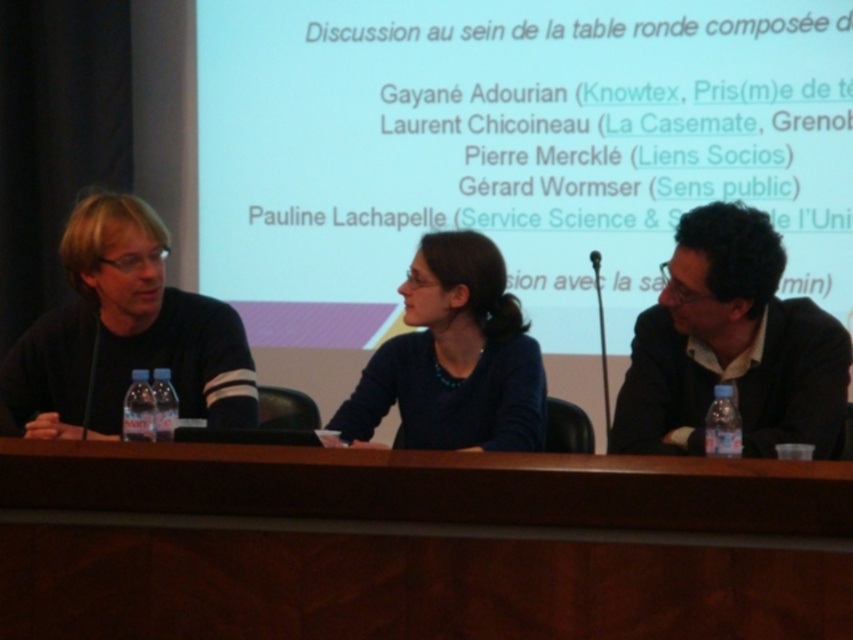
You are a photographer setting up for a panel discussion. You need to decide where to place a spotlight so that it can illuminate both the dark brown leather jacket at right and the matte blue sweater at center without causing glare on the projection screen. Considering their heights, which object should the spotlight be angled towards first?

The dark brown leather jacket at right is taller than the matte blue sweater at center, so the spotlight should be angled towards the dark brown leather jacket at right first to ensure both are illuminated without glare.

You are a photographer adjusting your camera settings to capture the panel discussion. You notice two points of interest in your viewfinder at coordinates point (x=45, y=566) and point (x=740, y=284). Which point is closer to your camera lens?

Point (x=45, y=566) is closer to the viewer than point (x=740, y=284).

You are organizing a small event and need to seat 4 people around the brown wood table at center. The matte blue sweater at center is currently placed on the table. Considering the table and sweater, can you fit 4 people comfortably around the table?

The brown wood table at center is wider than the matte blue sweater at center. Since the sweater is on the table, there is enough space for 4 people to sit comfortably around the brown wood table at center.